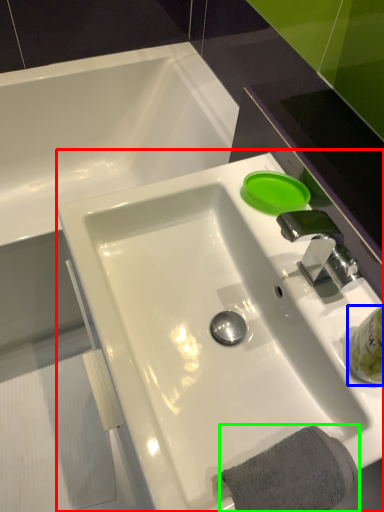
Question: Which object is positioned closest to sink (highlighted by a red box)? Select from liquid (highlighted by a blue box) and bath towel (highlighted by a green box).

Choices:
 (A) liquid
 (B) bath towel

Answer: (B)